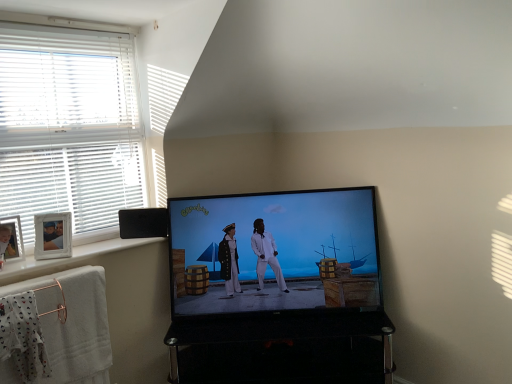
You are a GUI agent. You are given a task and a screenshot of the screen. Output one action in this format:
    pyautogui.click(x=<x>, y=<y>)
    Task: Click on the blank space situated above white cotton bath towel at lower left (from a real-world perspective)
    
    Given the screenshot: What is the action you would take?
    click(61, 274)